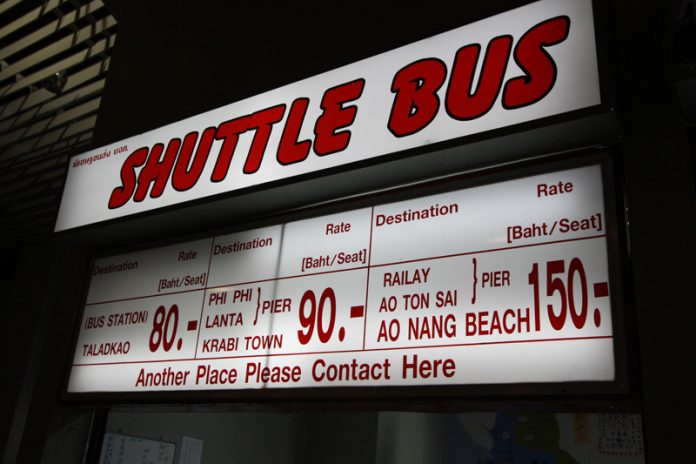
In order to click on wall in this screenshot , I will do `click(670, 188)`.